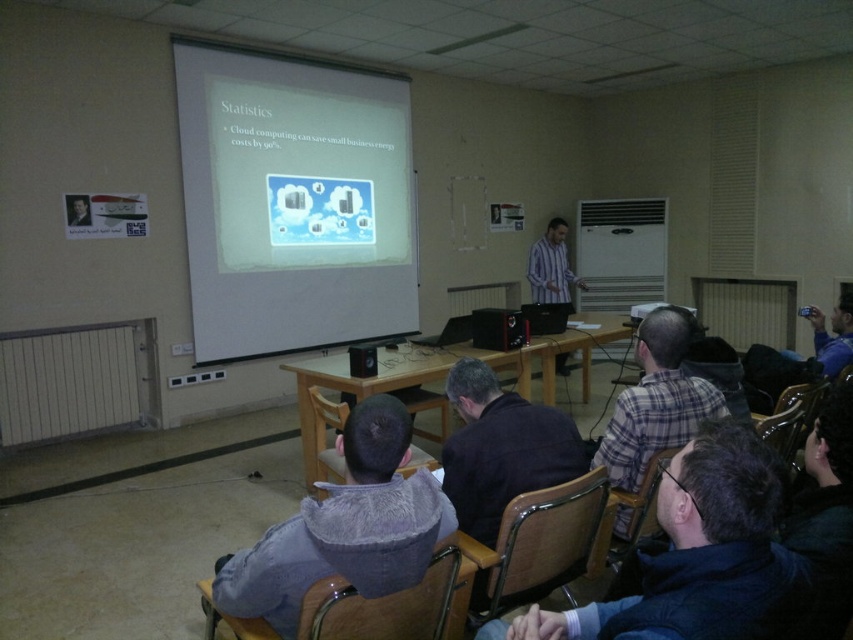
Question: Which object appears closest to the camera in this image?

Choices:
 (A) dark blue fabric at center
 (B) striped shirt at center

Answer: (A)

Question: Does dark blue hoodie at lower right have a larger size compared to gray fuzzy jacket at lower center?

Choices:
 (A) yes
 (B) no

Answer: (B)

Question: Can you confirm if dark blue hoodie at lower right is bigger than dark blue fabric at center?

Choices:
 (A) no
 (B) yes

Answer: (A)

Question: Which point is closer to the camera?

Choices:
 (A) dark blue fabric at center
 (B) gray fuzzy jacket at lower center

Answer: (B)

Question: Which of these objects is positioned closest to the dark blue hoodie at lower right?

Choices:
 (A) striped shirt at center
 (B) white matte projection screen at upper center
 (C) dark blue fabric at center

Answer: (C)

Question: Where is white matte projection screen at upper center located in relation to dark blue hoodie at lower right in the image?

Choices:
 (A) right
 (B) left

Answer: (B)